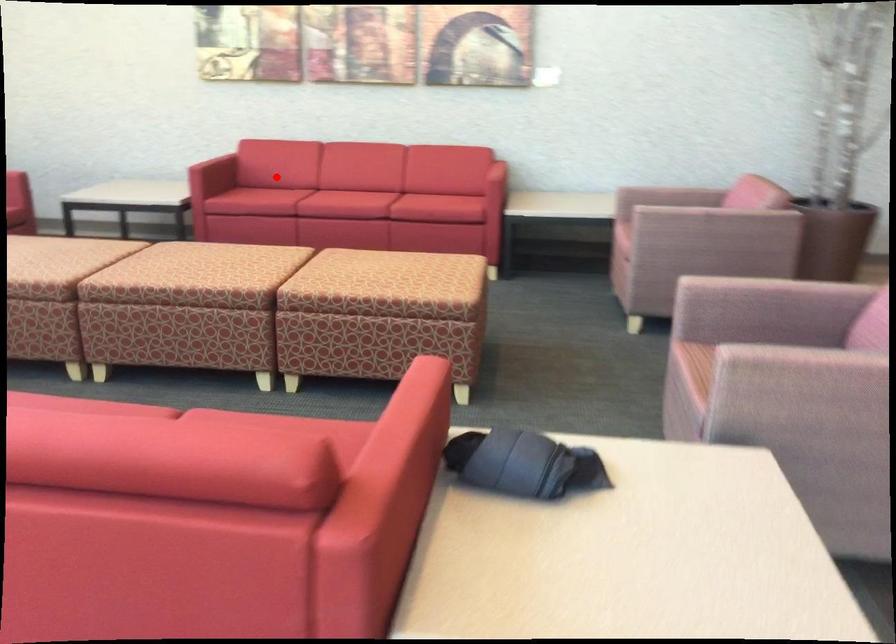
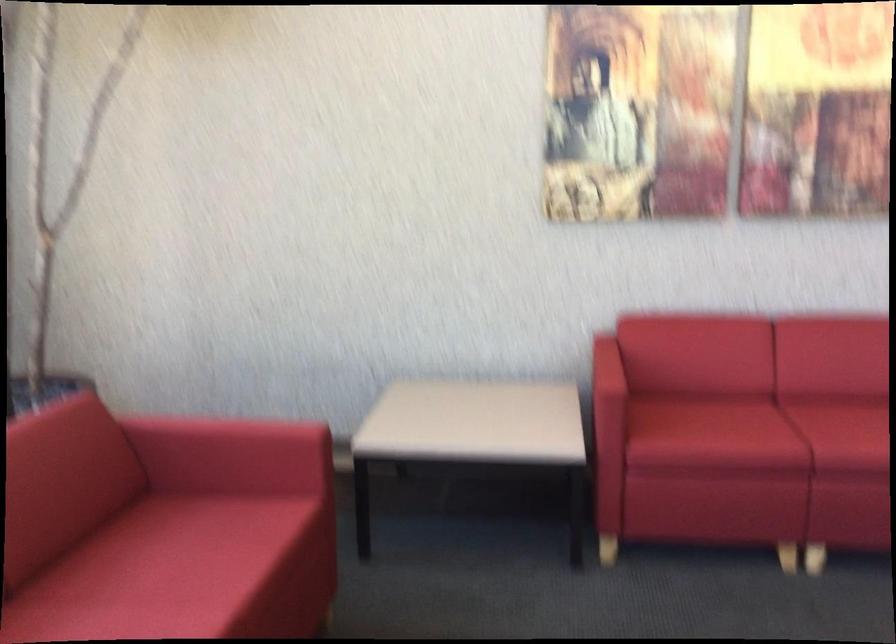
The point at the highlighted location is marked in the first image. Where is the corresponding point in the second image?

(757, 431)